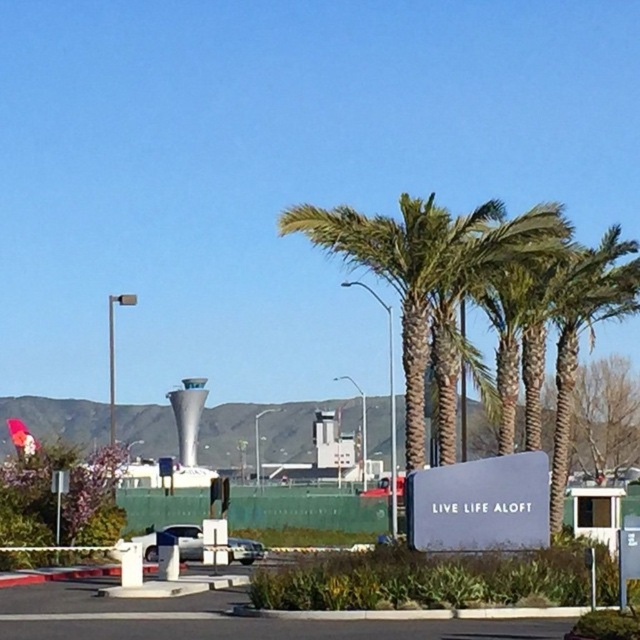
You are standing at the edge of the airport runway and see both the metallic silver car at center and the metallic silver sedan at center. Which vehicle is nearer to you?

The metallic silver car at center is closer to the viewer than the metallic silver sedan at center, so the metallic silver car at center is nearer.